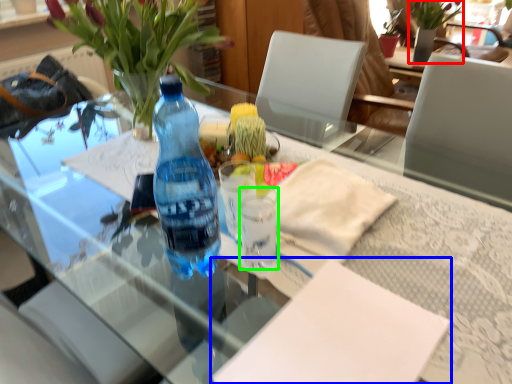
Question: Estimate the real-world distances between objects in this image. Which object is closer to bouquet (highlighted by a red box), notepad (highlighted by a blue box) or coffee cup (highlighted by a green box)?

Choices:
 (A) notepad
 (B) coffee cup

Answer: (B)